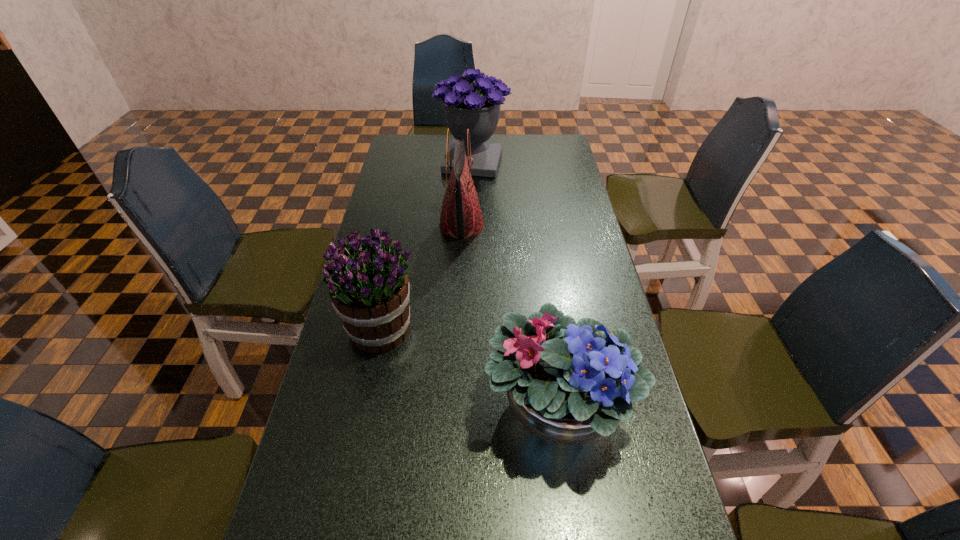
You are a GUI agent. You are given a task and a screenshot of the screen. Output one action in this format:
    pyautogui.click(x=<x>, y=<y>)
    Task: Click on the blank region between the tallest bouquet and the second shortest bouquet
    
    Given the screenshot: What is the action you would take?
    pyautogui.click(x=427, y=246)

Find the location of a particular element. The height and width of the screenshot is (540, 960). vacant area that lies between the tallest bouquet and the second tallest bouquet is located at coordinates (427, 246).

Locate an element on the screen. This screenshot has height=540, width=960. object that is the second nearest to the handbag is located at coordinates (369, 288).

I want to click on object that is the second closest to the shortest bouquet, so click(461, 216).

Choose which bouquet is the second nearest neighbor to the second shortest bouquet. Please provide its 2D coordinates. Your answer should be formatted as a tuple, i.e. [(x, y)], where the tuple contains the x and y coordinates of a point satisfying the conditions above.

[(477, 108)]

Locate which bouquet is the closest to the farthest object. Please provide its 2D coordinates. Your answer should be formatted as a tuple, i.e. [(x, y)], where the tuple contains the x and y coordinates of a point satisfying the conditions above.

[(369, 288)]